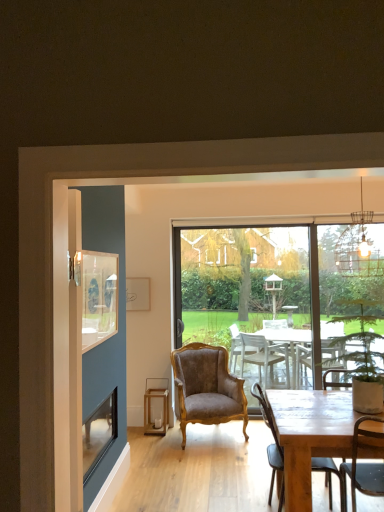
Question: Which direction should I rotate to look at velvet brown armchair at center, arranged as the second chair when viewed from the front?

Choices:
 (A) right
 (B) left

Answer: (A)

Question: From the image's perspective, is green leafy plant in pot at right under wooden chair at lower right, which is the first chair from right to left?

Choices:
 (A) no
 (B) yes

Answer: (A)

Question: Considering the relative sizes of green leafy plant in pot at right and wooden chair at lower right, which ranks as the second chair in back-to-front order, in the image provided, is green leafy plant in pot at right wider than wooden chair at lower right, which ranks as the second chair in back-to-front order,?

Choices:
 (A) yes
 (B) no

Answer: (B)

Question: Can you confirm if green leafy plant in pot at right is shorter than wooden chair at lower right, which ranks as the second chair in back-to-front order?

Choices:
 (A) no
 (B) yes

Answer: (B)

Question: Does green leafy plant in pot at right lie behind wooden chair at lower right, which ranks as the second chair in back-to-front order?

Choices:
 (A) yes
 (B) no

Answer: (B)

Question: From a real-world perspective, is green leafy plant in pot at right under wooden chair at lower right, which is the first chair from right to left?

Choices:
 (A) yes
 (B) no

Answer: (B)

Question: Considering the relative sizes of green leafy plant in pot at right and wooden chair at lower right, which is the first chair from right to left, in the image provided, is green leafy plant in pot at right taller than wooden chair at lower right, which is the first chair from right to left,?

Choices:
 (A) yes
 (B) no

Answer: (B)

Question: Is wooden chair at lower right, which is the first chair from right to left, behind wooden lantern at lower center?

Choices:
 (A) yes
 (B) no

Answer: (B)

Question: Is wooden lantern at lower center at the back of wooden chair at lower right, marked as the 1th chair in a front-to-back arrangement?

Choices:
 (A) no
 (B) yes

Answer: (A)

Question: Is wooden chair at lower right, which ranks as the second chair in back-to-front order, oriented towards wooden lantern at lower center?

Choices:
 (A) no
 (B) yes

Answer: (A)

Question: From a real-world perspective, is wooden chair at lower right, marked as the 1th chair in a front-to-back arrangement, on top of wooden lantern at lower center?

Choices:
 (A) yes
 (B) no

Answer: (A)

Question: Is wooden chair at lower right, marked as the 1th chair in a front-to-back arrangement, closer to the viewer compared to wooden lantern at lower center?

Choices:
 (A) no
 (B) yes

Answer: (B)

Question: From a real-world perspective, is wooden chair at lower right, acting as the second chair starting from the left, positioned under wooden lantern at lower center based on gravity?

Choices:
 (A) no
 (B) yes

Answer: (A)

Question: Can you confirm if velvet brown armchair at center, which appears as the 1th chair when viewed from the back, is thinner than velvet brown armchair at center?

Choices:
 (A) no
 (B) yes

Answer: (A)